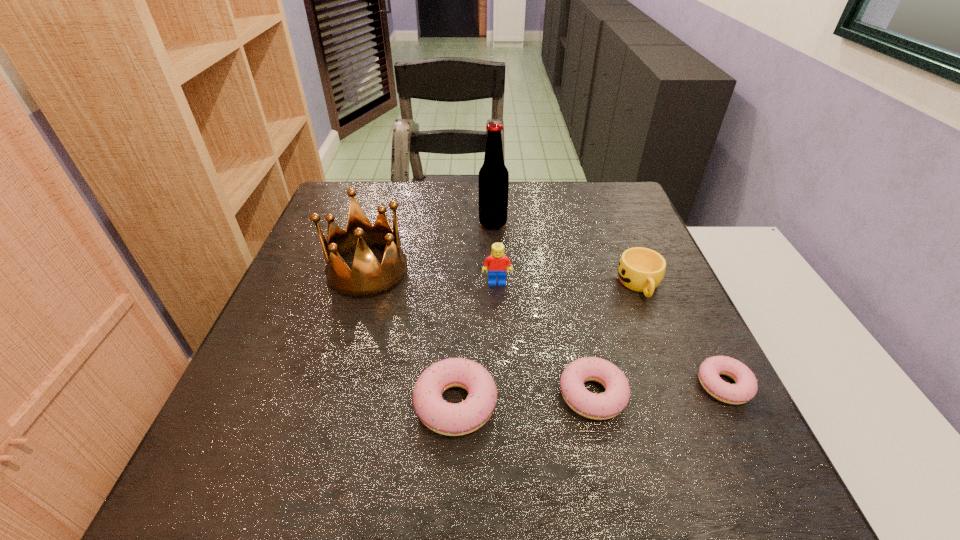
I want to click on Lego, so coord(497,261).

Locate an element on the screen. This screenshot has height=540, width=960. blank area located on the left of the leftmost doughnut is located at coordinates (364, 404).

Locate an element on the screen. The height and width of the screenshot is (540, 960). free space located on the back of the third object from right to left is located at coordinates pyautogui.click(x=567, y=284).

At what (x,y) coordinates should I click in order to perform the action: click on vacant space situated 0.330m on the left of the rightmost doughnut. Please return your answer as a coordinate pair (x, y). Looking at the image, I should click on (519, 385).

The width and height of the screenshot is (960, 540). I want to click on vacant region located 0.280m on the right of the beer bottle, so tap(609, 224).

Locate an element on the screen. Image resolution: width=960 pixels, height=540 pixels. blank space located on the right of the second tallest object is located at coordinates (536, 272).

You are a GUI agent. You are given a task and a screenshot of the screen. Output one action in this format:
    pyautogui.click(x=<x>, y=<y>)
    Task: Click on the vacant space located on the back of the cup
    This screenshot has height=540, width=960.
    Given the screenshot: What is the action you would take?
    pyautogui.click(x=606, y=202)

Where is `free space located on the face of the Lego`? The width and height of the screenshot is (960, 540). free space located on the face of the Lego is located at coordinates coord(500,359).

I want to click on object present at the far edge, so click(493, 176).

Where is `object that is positioned at the left edge`? This screenshot has width=960, height=540. object that is positioned at the left edge is located at coordinates (368, 278).